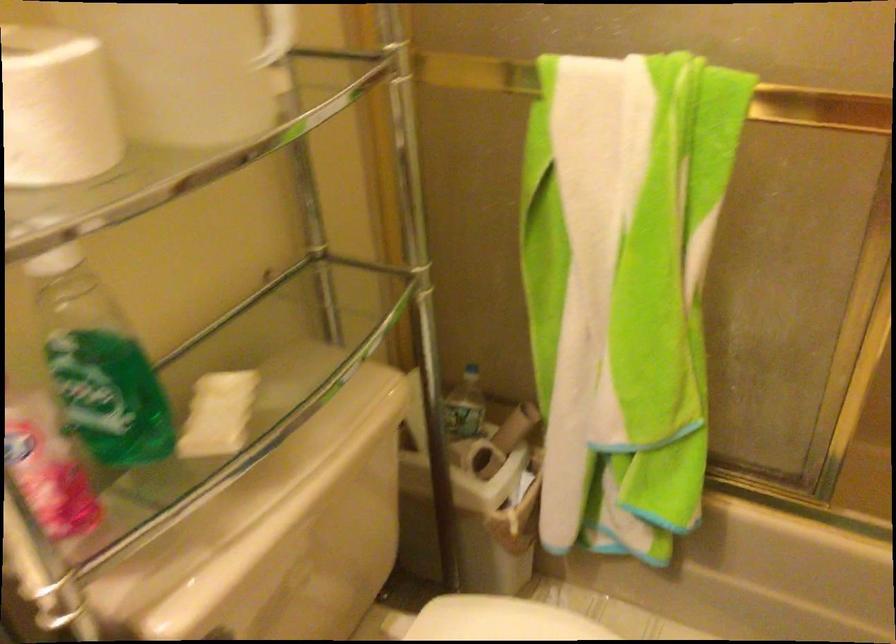
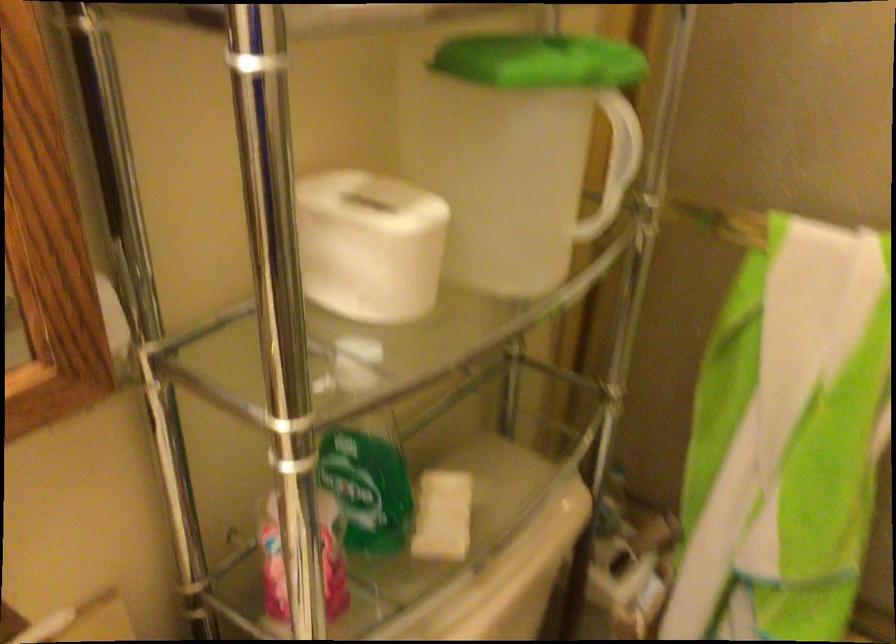
Where in the second image is the point corresponding to pixel 105 393 from the first image?

(367, 489)